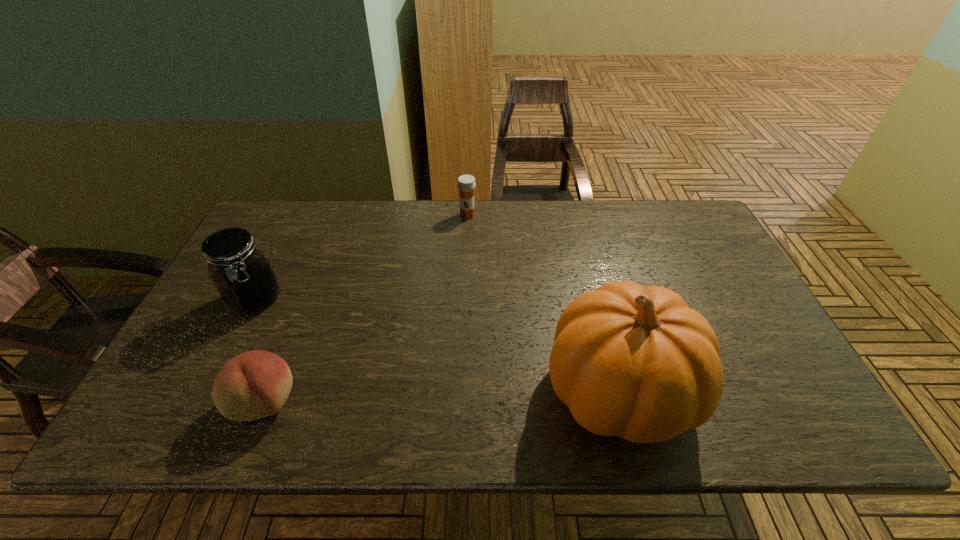
Locate an element on the screen. free space on the desktop that is between the peach and the rightmost object and is positioned on the label side of the second object from right to left is located at coordinates (403, 397).

The height and width of the screenshot is (540, 960). Find the location of `free space on the desktop that is between the peach and the pumpkin and is positioned on the lid of the third shortest object`. free space on the desktop that is between the peach and the pumpkin and is positioned on the lid of the third shortest object is located at coordinates (423, 397).